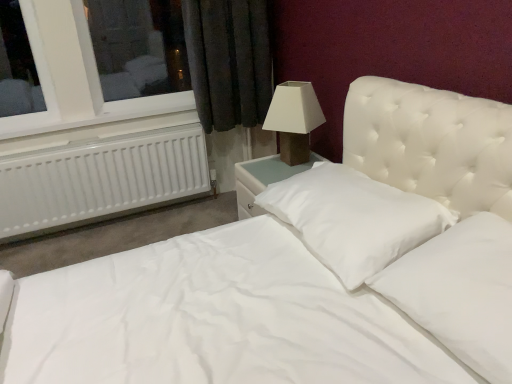
The image size is (512, 384). Describe the element at coordinates (460, 292) in the screenshot. I see `white soft pillow at center, which is the second pillow in back-to-front order` at that location.

Where is `white soft pillow at center, positioned as the 1th pillow in front-to-back order`? white soft pillow at center, positioned as the 1th pillow in front-to-back order is located at coordinates (460, 292).

The height and width of the screenshot is (384, 512). What do you see at coordinates (353, 219) in the screenshot?
I see `white smooth pillow at center, marked as the second pillow in a front-to-back arrangement` at bounding box center [353, 219].

Locate an element on the screen. white smooth pillow at center, marked as the second pillow in a front-to-back arrangement is located at coordinates (353, 219).

Find the location of a particular element. This screenshot has height=384, width=512. white plastic radiator at left is located at coordinates (61, 83).

In order to face matte brown lamp at upper right, should I rotate leftwards or rightwards?

To align with it, rotate right about 4.913°.

At what (x,y) coordinates should I click in order to perform the action: click on white soft pillow at center, positioned as the 1th pillow in front-to-back order. Please return your answer as a coordinate pair (x, y). This screenshot has width=512, height=384. Looking at the image, I should click on (460, 292).

Which object is closer to the camera taking this photo, matte brown lamp at upper right or white smooth pillow at center, marked as the second pillow in a front-to-back arrangement?

white smooth pillow at center, marked as the second pillow in a front-to-back arrangement, is closer to the camera.

Locate an element on the screen. The width and height of the screenshot is (512, 384). lamp behind the white smooth pillow at center, which is the 1th pillow in back-to-front order is located at coordinates (294, 119).

Is matte brown lamp at upper right not within white smooth pillow at center, marked as the second pillow in a front-to-back arrangement?

Yes, matte brown lamp at upper right is located beyond the bounds of white smooth pillow at center, marked as the second pillow in a front-to-back arrangement.

Would you say matte brown lamp at upper right is a long distance from white smooth pillow at center, which is the 1th pillow in back-to-front order?

They are positioned close to each other.

In the image, is white plastic radiator at left positioned in front of or behind white soft pillow at center, positioned as the 1th pillow in front-to-back order?

Clearly, white plastic radiator at left is behind white soft pillow at center, positioned as the 1th pillow in front-to-back order.

From a real-world perspective, between white plastic radiator at left and white soft pillow at center, positioned as the 1th pillow in front-to-back order, who is vertically lower?

white soft pillow at center, positioned as the 1th pillow in front-to-back order.

In order to click on window positioned vertically above the white soft pillow at center, positioned as the 1th pillow in front-to-back order (from a real-world perspective) in this screenshot , I will do `click(61, 83)`.

Can you tell me how much white plastic radiator at left and white soft pillow at center, positioned as the 1th pillow in front-to-back order, differ in facing direction?

white plastic radiator at left and white soft pillow at center, positioned as the 1th pillow in front-to-back order, are facing 91.3 degrees away from each other.

Is white soft pillow at center, which is the second pillow in back-to-front order, inside white smooth pillow at center, which is the 1th pillow in back-to-front order?

No, white soft pillow at center, which is the second pillow in back-to-front order, is not surrounded by white smooth pillow at center, which is the 1th pillow in back-to-front order.

From a real-world perspective, between white smooth pillow at center, which is the 1th pillow in back-to-front order, and white soft pillow at center, positioned as the 1th pillow in front-to-back order, who is vertically lower?

white smooth pillow at center, which is the 1th pillow in back-to-front order, from a real-world perspective.

Consider the image. From the image's perspective, is white smooth pillow at center, which is the 1th pillow in back-to-front order, under white soft pillow at center, positioned as the 1th pillow in front-to-back order?

Incorrect, from the image's perspective, white smooth pillow at center, which is the 1th pillow in back-to-front order, is higher than white soft pillow at center, positioned as the 1th pillow in front-to-back order.

Choose the correct answer: Is white smooth pillow at center, which is the 1th pillow in back-to-front order, inside matte brown lamp at upper right or outside it?

white smooth pillow at center, which is the 1th pillow in back-to-front order, exists outside the volume of matte brown lamp at upper right.

Is white smooth pillow at center, which is the 1th pillow in back-to-front order, taller than matte brown lamp at upper right?

No, white smooth pillow at center, which is the 1th pillow in back-to-front order, is not taller than matte brown lamp at upper right.

Between point (336, 174) and point (298, 147), which one is positioned behind?

The point (298, 147) is farther.

Who is taller, white soft pillow at center, positioned as the 1th pillow in front-to-back order, or white plastic radiator at left?

Standing taller between the two is white plastic radiator at left.

Considering the relative positions of white soft pillow at center, which is the second pillow in back-to-front order, and white plastic radiator at left in the image provided, is white soft pillow at center, which is the second pillow in back-to-front order, to the left or to the right of white plastic radiator at left?

Clearly, white soft pillow at center, which is the second pillow in back-to-front order, is on the right of white plastic radiator at left in the image.

Starting from the white plastic radiator at left, which pillow is the 2nd one in front? Please provide its 2D coordinates.

[(460, 292)]

How many degrees apart are the facing directions of white soft pillow at center, positioned as the 1th pillow in front-to-back order, and white plastic radiator at left?

The angular difference between white soft pillow at center, positioned as the 1th pillow in front-to-back order, and white plastic radiator at left is 91.3 degrees.

Based on the photo, which object is closer to the camera taking this photo, matte brown lamp at upper right or white plastic radiator at left?

matte brown lamp at upper right is more forward.

Is matte brown lamp at upper right at the left side of white plastic radiator at left?

No, matte brown lamp at upper right is not to the left of white plastic radiator at left.

Between matte brown lamp at upper right and white plastic radiator at left, which one has smaller size?

With smaller size is matte brown lamp at upper right.

How many degrees apart are the facing directions of matte brown lamp at upper right and white plastic radiator at left?

89 degrees separate the facing orientations of matte brown lamp at upper right and white plastic radiator at left.

From the image's perspective, which is above, white soft pillow at center, which is the second pillow in back-to-front order, or matte brown lamp at upper right?

matte brown lamp at upper right.

Does white soft pillow at center, positioned as the 1th pillow in front-to-back order, have a larger size compared to matte brown lamp at upper right?

No.

Between white soft pillow at center, which is the second pillow in back-to-front order, and matte brown lamp at upper right, which one is positioned in front?

Positioned in front is white soft pillow at center, which is the second pillow in back-to-front order.

The image size is (512, 384). I want to click on lamp above the white smooth pillow at center, which is the 1th pillow in back-to-front order (from the image's perspective), so click(x=294, y=119).

Where is `window lying on the left of white soft pillow at center, which is the second pillow in back-to-front order`? The width and height of the screenshot is (512, 384). window lying on the left of white soft pillow at center, which is the second pillow in back-to-front order is located at coordinates (61, 83).

Considering their positions, is matte brown lamp at upper right positioned closer to white smooth pillow at center, marked as the second pillow in a front-to-back arrangement, than white plastic radiator at left?

The object closer to white smooth pillow at center, marked as the second pillow in a front-to-back arrangement, is matte brown lamp at upper right.

Estimate the real-world distances between objects in this image. Which object is further from white smooth pillow at center, marked as the second pillow in a front-to-back arrangement, white plastic radiator at left or white plastic radiator at left?

white plastic radiator at left is further to white smooth pillow at center, marked as the second pillow in a front-to-back arrangement.

When comparing their distances from white plastic radiator at left, does white soft pillow at center, positioned as the 1th pillow in front-to-back order, or matte brown lamp at upper right seem closer?

matte brown lamp at upper right is closer to white plastic radiator at left.

From the image, which object appears to be nearer to white smooth pillow at center, marked as the second pillow in a front-to-back arrangement, white plastic radiator at left or white plastic radiator at left?

white plastic radiator at left is closer to white smooth pillow at center, marked as the second pillow in a front-to-back arrangement.

Considering their positions, is matte brown lamp at upper right positioned closer to white plastic radiator at left than white soft pillow at center, which is the second pillow in back-to-front order?

matte brown lamp at upper right is closer to white plastic radiator at left.

Based on their spatial positions, is white plastic radiator at left or white soft pillow at center, which is the second pillow in back-to-front order, further from white plastic radiator at left?

Based on the image, white soft pillow at center, which is the second pillow in back-to-front order, appears to be further to white plastic radiator at left.

From the picture: Which object lies nearer to the anchor point matte brown lamp at upper right, white smooth pillow at center, which is the 1th pillow in back-to-front order, or white plastic radiator at left?

white smooth pillow at center, which is the 1th pillow in back-to-front order, is positioned closer to the anchor matte brown lamp at upper right.

Looking at the image, which one is located closer to white plastic radiator at left, white soft pillow at center, positioned as the 1th pillow in front-to-back order, or white plastic radiator at left?

white plastic radiator at left.

Identify the location of lamp located between white plastic radiator at left and white smooth pillow at center, which is the 1th pillow in back-to-front order, in the left-right direction. This screenshot has width=512, height=384. (294, 119).

You are a GUI agent. You are given a task and a screenshot of the screen. Output one action in this format:
    pyautogui.click(x=<x>, y=<y>)
    Task: Click on the pillow between white soft pillow at center, which is the second pillow in back-to-front order, and matte brown lamp at upper right in the front-back direction
    
    Given the screenshot: What is the action you would take?
    pyautogui.click(x=353, y=219)

In order to click on window between white plastic radiator at left and white soft pillow at center, which is the second pillow in back-to-front order in this screenshot , I will do `click(61, 83)`.

Where is `window between white plastic radiator at left and matte brown lamp at upper right from left to right`? The height and width of the screenshot is (384, 512). window between white plastic radiator at left and matte brown lamp at upper right from left to right is located at coordinates (61, 83).